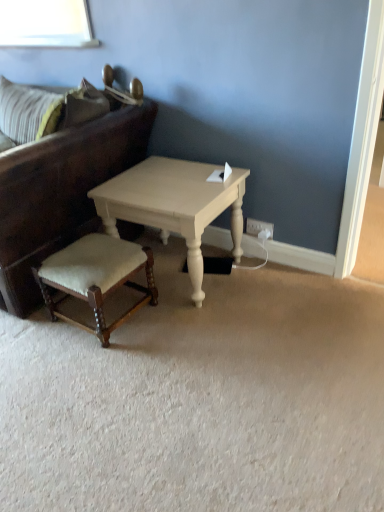
Question: Does white plastic electric outlet at lower right have a greater width compared to velvet beige stool at lower left?

Choices:
 (A) yes
 (B) no

Answer: (B)

Question: Is white plastic electric outlet at lower right bigger than velvet beige stool at lower left?

Choices:
 (A) yes
 (B) no

Answer: (B)

Question: From the image's perspective, is white plastic electric outlet at lower right located above velvet beige stool at lower left?

Choices:
 (A) yes
 (B) no

Answer: (A)

Question: Does white plastic electric outlet at lower right have a smaller size compared to velvet beige stool at lower left?

Choices:
 (A) yes
 (B) no

Answer: (A)

Question: From the image's perspective, is white plastic electric outlet at lower right below velvet beige stool at lower left?

Choices:
 (A) no
 (B) yes

Answer: (A)

Question: In terms of height, does dark brown leather studio couch at left look taller or shorter compared to white painted wood coffee table at center?

Choices:
 (A) tall
 (B) short

Answer: (A)

Question: From a real-world perspective, is dark brown leather studio couch at left physically located above or below white painted wood coffee table at center?

Choices:
 (A) above
 (B) below

Answer: (A)

Question: In terms of size, does dark brown leather studio couch at left appear bigger or smaller than white painted wood coffee table at center?

Choices:
 (A) big
 (B) small

Answer: (A)

Question: Visually, is dark brown leather studio couch at left positioned to the left or to the right of white painted wood coffee table at center?

Choices:
 (A) right
 (B) left

Answer: (B)

Question: Would you say velvet beige stool at lower left is inside or outside dark brown leather studio couch at left?

Choices:
 (A) outside
 (B) inside

Answer: (A)

Question: Considering the positions of velvet beige stool at lower left and dark brown leather studio couch at left in the image, is velvet beige stool at lower left taller or shorter than dark brown leather studio couch at left?

Choices:
 (A) tall
 (B) short

Answer: (B)

Question: Is point (107, 239) closer or farther from the camera than point (49, 158)?

Choices:
 (A) farther
 (B) closer

Answer: (A)

Question: Relative to dark brown leather studio couch at left, is velvet beige stool at lower left in front or behind?

Choices:
 (A) front
 (B) behind

Answer: (B)

Question: In terms of size, does dark brown leather studio couch at left appear bigger or smaller than white plastic electric outlet at lower right?

Choices:
 (A) small
 (B) big

Answer: (B)

Question: From the image's perspective, is dark brown leather studio couch at left located above or below white plastic electric outlet at lower right?

Choices:
 (A) above
 (B) below

Answer: (A)